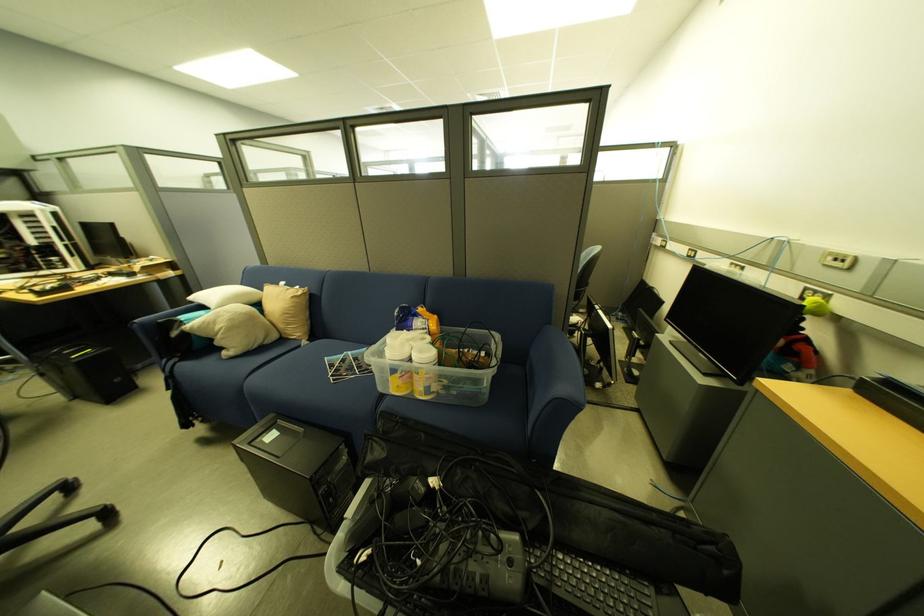
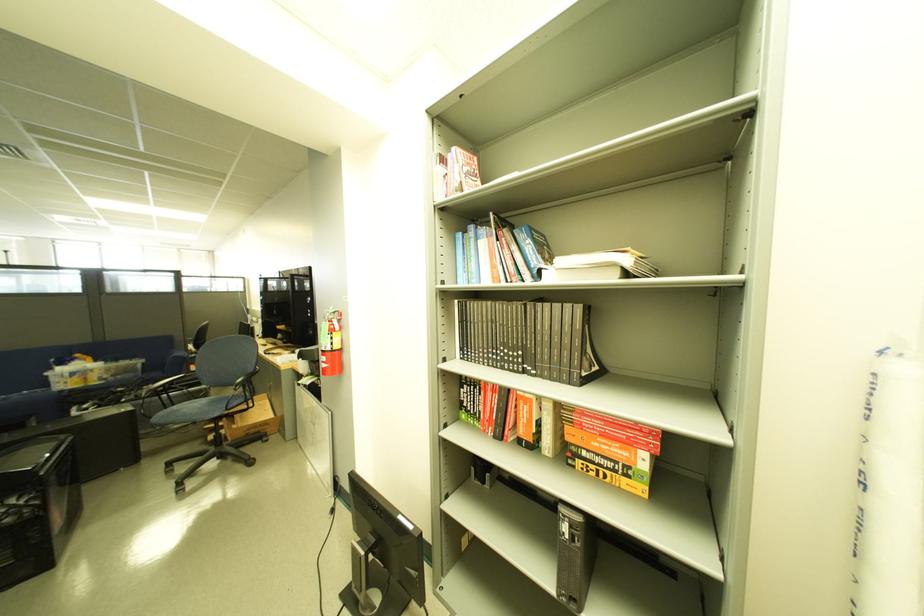
Where in the second image is the point corresponding to pixel 408 390 from the first image?

(88, 385)